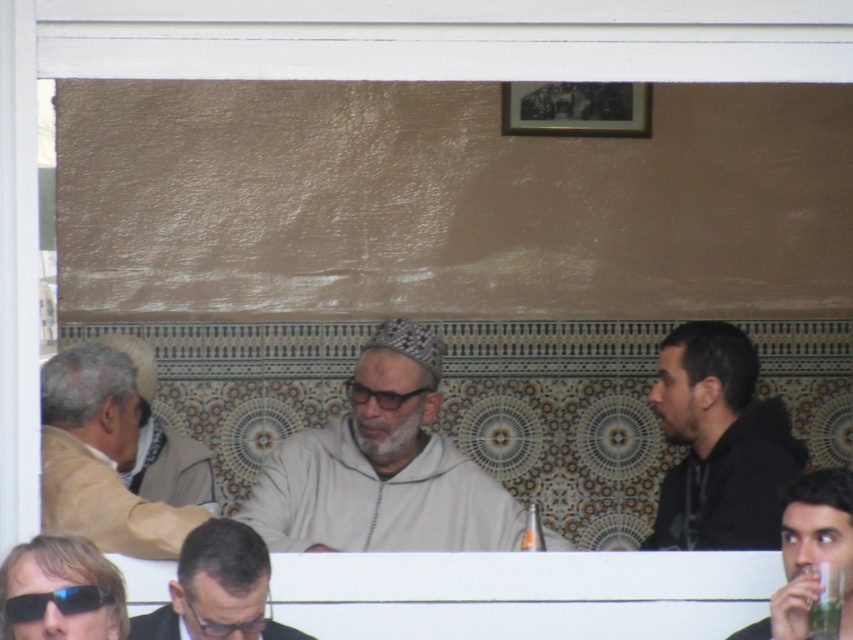
Is black plastic glasses at center to the right of matte black goggles at lower center from the viewer's perspective?

Indeed, black plastic glasses at center is positioned on the right side of matte black goggles at lower center.

From the picture: Does black plastic glasses at center have a smaller size compared to matte black goggles at lower center?

Yes.

Locate an element on the screen. black plastic glasses at center is located at coordinates (378, 396).

Locate an element on the screen. Image resolution: width=853 pixels, height=640 pixels. black plastic glasses at center is located at coordinates (378, 396).

The image size is (853, 640). Describe the element at coordinates (55, 602) in the screenshot. I see `shiny blue plastic goggles at lower left` at that location.

Which of these two, shiny blue plastic goggles at lower left or black plastic glasses at center, stands shorter?

black plastic glasses at center is shorter.

The height and width of the screenshot is (640, 853). Find the location of `shiny blue plastic goggles at lower left`. shiny blue plastic goggles at lower left is located at coordinates (55, 602).

Does dark brown hair at lower center have a greater height compared to black plastic glasses at center?

Indeed, dark brown hair at lower center has a greater height compared to black plastic glasses at center.

Is dark brown hair at lower center positioned before black plastic glasses at center?

Yes, dark brown hair at lower center is in front of black plastic glasses at center.

Between point (244, 538) and point (376, 392), which one is positioned behind?

The point (376, 392) is behind.

This screenshot has width=853, height=640. In order to click on dark brown hair at lower center in this screenshot , I will do `click(216, 589)`.